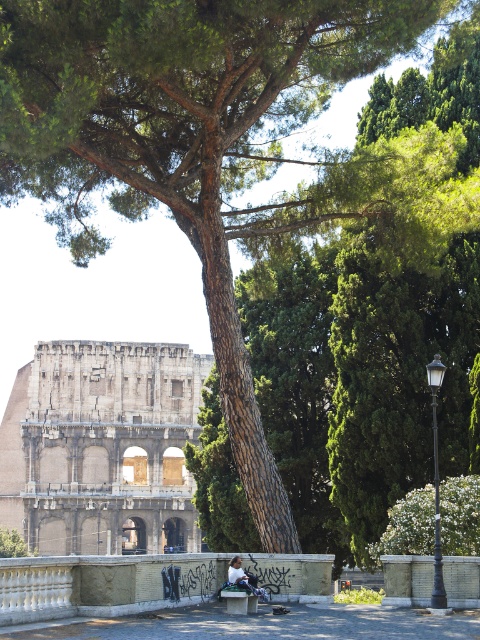
Question: In this image, where is stone amphitheater at center located relative to white fabric bag at lower center?

Choices:
 (A) right
 (B) left

Answer: (B)

Question: Among these objects, which one is nearest to the camera?

Choices:
 (A) stone amphitheater at center
 (B) white fabric bag at lower center

Answer: (B)

Question: Can you confirm if white fabric bag at lower center is smaller than wooden park bench at center?

Choices:
 (A) yes
 (B) no

Answer: (A)

Question: Which of these objects is positioned closest to the stone amphitheater at center?

Choices:
 (A) wooden park bench at center
 (B) white fabric bag at lower center

Answer: (B)

Question: Which object is farther from the camera taking this photo?

Choices:
 (A) stone amphitheater at center
 (B) wooden park bench at center
 (C) white fabric bag at lower center

Answer: (A)

Question: Does stone amphitheater at center appear on the left side of wooden park bench at center?

Choices:
 (A) yes
 (B) no

Answer: (A)